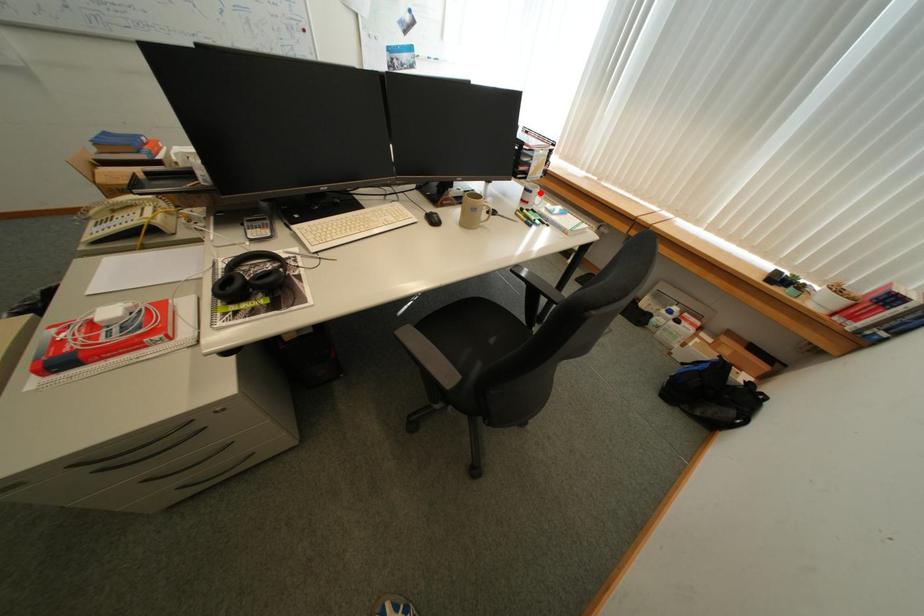
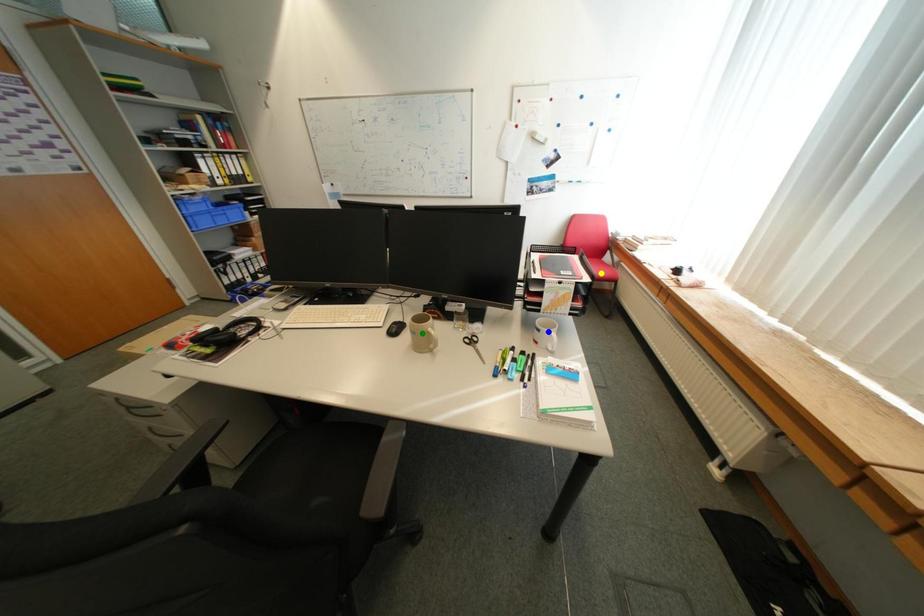
Question: I am providing you with two images of the same scene from different viewpoints. A red point is marked on the first image. You are given multiple points on the second image. Which point in image 2 is actually the same real-world point as the red point in image 1?

Choices:
 (A) yellow point
 (B) green point
 (C) blue point

Answer: (C)